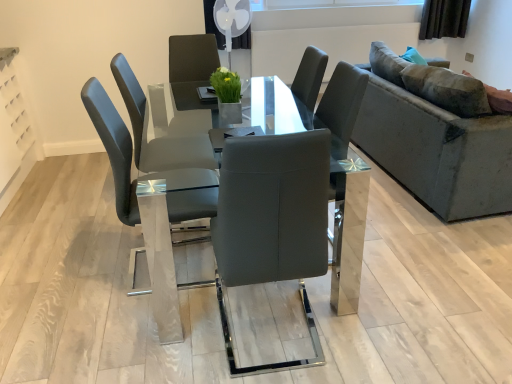
This screenshot has width=512, height=384. Describe the element at coordinates (436, 136) in the screenshot. I see `velvet grey couch at right` at that location.

The height and width of the screenshot is (384, 512). I want to click on velvet grey couch at right, so click(x=436, y=136).

From the image's perspective, does velvet grey couch at right appear higher than transparent glass table at center?

Yes, from the image's perspective, velvet grey couch at right is on top of transparent glass table at center.

Does velvet grey couch at right appear on the right side of transparent glass table at center?

Correct, you'll find velvet grey couch at right to the right of transparent glass table at center.

Does velvet grey couch at right have a smaller size compared to transparent glass table at center?

→ No.

Between transparent glass table at center and matte gray chair at center, which one has smaller width?

With smaller width is matte gray chair at center.

Does transparent glass table at center turn towards matte gray chair at center?

Yes, transparent glass table at center is oriented towards matte gray chair at center.

Does point (296, 119) appear closer or farther from the camera than point (136, 80)?

Point (296, 119) is farther from the camera than point (136, 80).

Is transparent glass table at center situated inside matte gray chair at center or outside?

transparent glass table at center lies outside matte gray chair at center.

From the image's perspective, which is below, matte gray chair at center or transparent glass table at center?

transparent glass table at center, from the image's perspective.

I want to click on chair above the transparent glass table at center (from a real-world perspective), so click(157, 138).

Is the depth of matte gray chair at center greater than that of transparent glass table at center?

Yes.

From their relative heights in the image, would you say matte gray chair at center is taller or shorter than transparent glass table at center?

matte gray chair at center is taller than transparent glass table at center.

Is velvet grey couch at right far away from matte gray chair at center?

Indeed, velvet grey couch at right is not near matte gray chair at center.

Looking at this image, which is further, (378, 89) or (127, 70)?

The point (378, 89) is farther.

Is velvet grey couch at right completely or partially outside of matte gray chair at center?

Yes, velvet grey couch at right is outside of matte gray chair at center.

From a real-world perspective, who is located lower, velvet grey couch at right or matte gray chair at center?

velvet grey couch at right is physically lower.

Considering the positions of objects matte gray chair at center and velvet grey couch at right in the image provided, who is behind, matte gray chair at center or velvet grey couch at right?

velvet grey couch at right.

Does matte gray chair at center have a greater width compared to velvet grey couch at right?

Incorrect, the width of matte gray chair at center does not surpass that of velvet grey couch at right.

Between matte gray chair at center and velvet grey couch at right, which one appears on the left side from the viewer's perspective?

matte gray chair at center is more to the left.

Is velvet grey couch at right surrounded by matte gray chair at center?

No, velvet grey couch at right is not surrounded by matte gray chair at center.

Based on the photo, is transparent glass table at center to the left of velvet grey couch at right from the viewer's perspective?

Yes, transparent glass table at center is to the left of velvet grey couch at right.

From a real-world perspective, which is physically above, transparent glass table at center or velvet grey couch at right?

In real-world perspective, velvet grey couch at right is above.

How different are the orientations of transparent glass table at center and velvet grey couch at right in degrees?

The angle between the facing direction of transparent glass table at center and the facing direction of velvet grey couch at right is 0.947 degrees.

What are the coordinates of `studio couch on the right side of transparent glass table at center` in the screenshot? It's located at (436, 136).

The height and width of the screenshot is (384, 512). I want to click on table that is below the matte gray chair at center (from the image's perspective), so click(348, 229).

Looking at the image, which one is located further to transparent glass table at center, matte gray chair at center or velvet grey couch at right?

Among the two, matte gray chair at center is located further to transparent glass table at center.

From the picture: Which object lies further to the anchor point transparent glass table at center, velvet grey couch at right or matte gray chair at center?

matte gray chair at center lies further to transparent glass table at center than the other object.

In the scene shown: Considering their positions, is transparent glass table at center positioned further to matte gray chair at center than velvet grey couch at right?

velvet grey couch at right is further to matte gray chair at center.

Which object lies nearer to the anchor point velvet grey couch at right, matte gray chair at center or transparent glass table at center?

transparent glass table at center is closer to velvet grey couch at right.

Which object lies nearer to the anchor point matte gray chair at center, velvet grey couch at right or transparent glass table at center?

transparent glass table at center lies closer to matte gray chair at center than the other object.

From the image, which object appears to be nearer to velvet grey couch at right, transparent glass table at center or matte gray chair at center?

Among the two, transparent glass table at center is located nearer to velvet grey couch at right.

The height and width of the screenshot is (384, 512). Find the location of `table between matte gray chair at center and velvet grey couch at right`. table between matte gray chair at center and velvet grey couch at right is located at coordinates (348, 229).